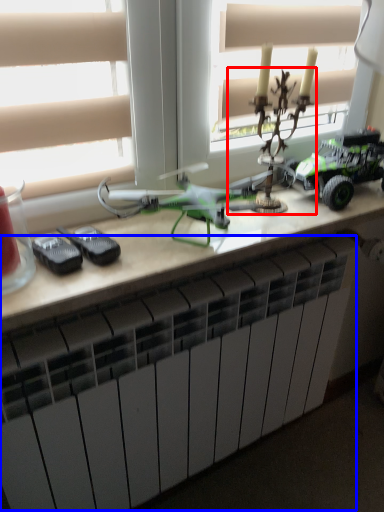
Question: Among these objects, which one is nearest to the camera, toy (highlighted by a red box) or radiator (highlighted by a blue box)?

Choices:
 (A) toy
 (B) radiator

Answer: (B)